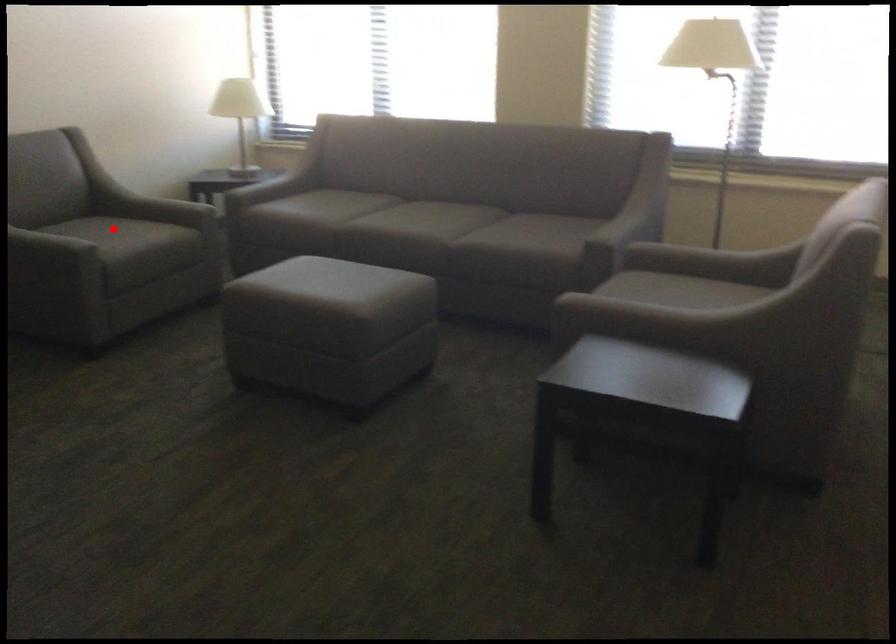
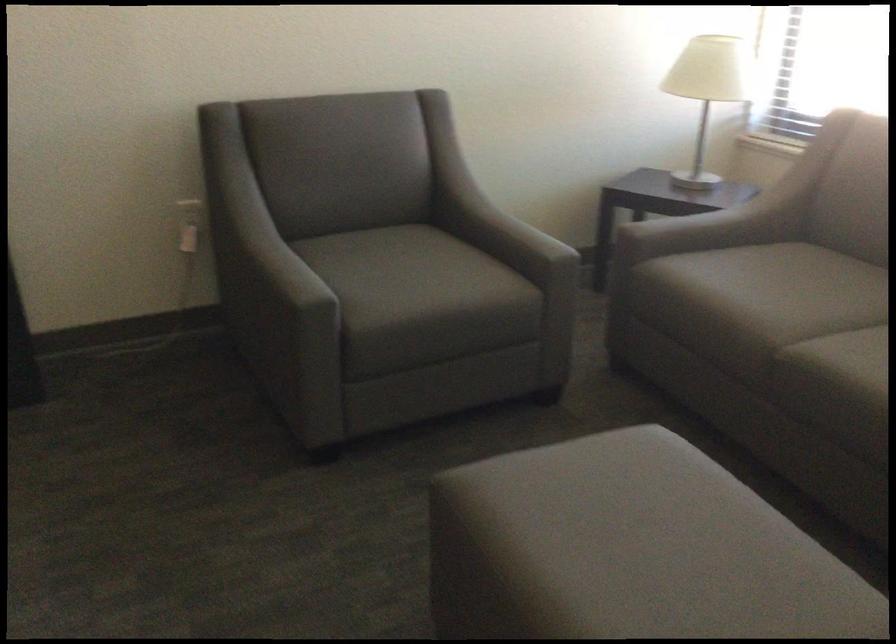
Locate, in the second image, the point that corresponds to the highlighted location in the first image.

(411, 263)